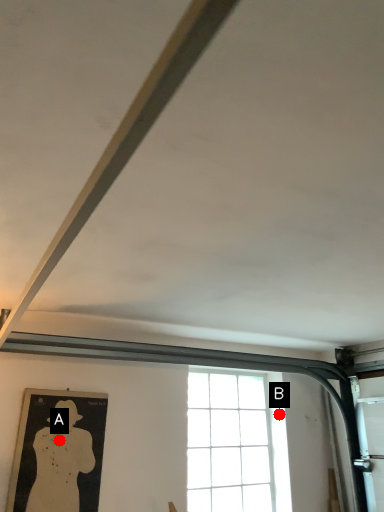
Question: Two points are circled on the image, labeled by A and B beside each circle. Which point is further to the camera?

Choices:
 (A) A is further
 (B) B is further

Answer: (B)